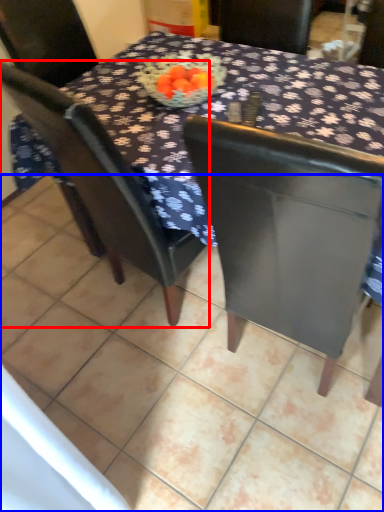
Question: Which object is further to the camera taking this photo, chair (highlighted by a red box) or tile (highlighted by a blue box)?

Choices:
 (A) chair
 (B) tile

Answer: (A)